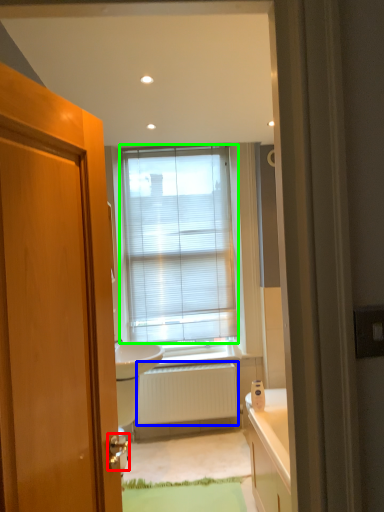
Question: Estimate the real-world distances between objects in this image. Which object is farther from door handle (highlighted by a red box), radiator (highlighted by a blue box) or window blind (highlighted by a green box)?

Choices:
 (A) radiator
 (B) window blind

Answer: (B)